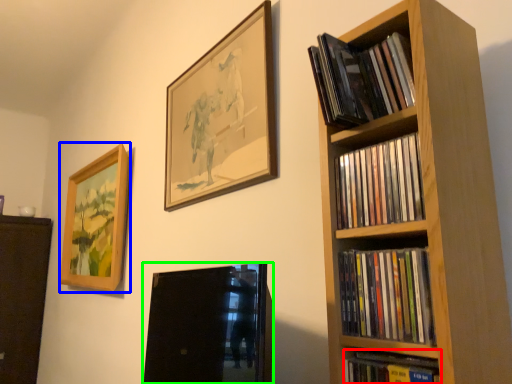
Question: Which is nearer to the book (highlighted by a red box)? picture frame (highlighted by a blue box) or picture frame (highlighted by a green box).

Choices:
 (A) picture frame
 (B) picture frame

Answer: (A)